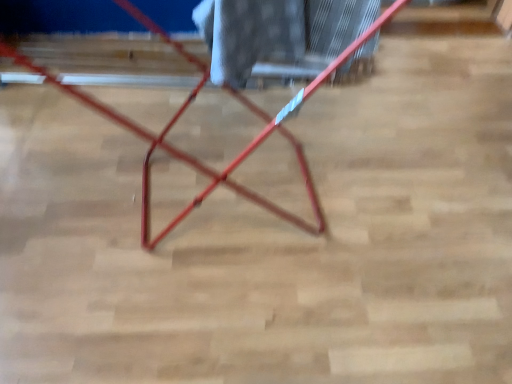
Locate an element on the screen. vacant space positioned to the left of metallic red ladder at center is located at coordinates (48, 157).